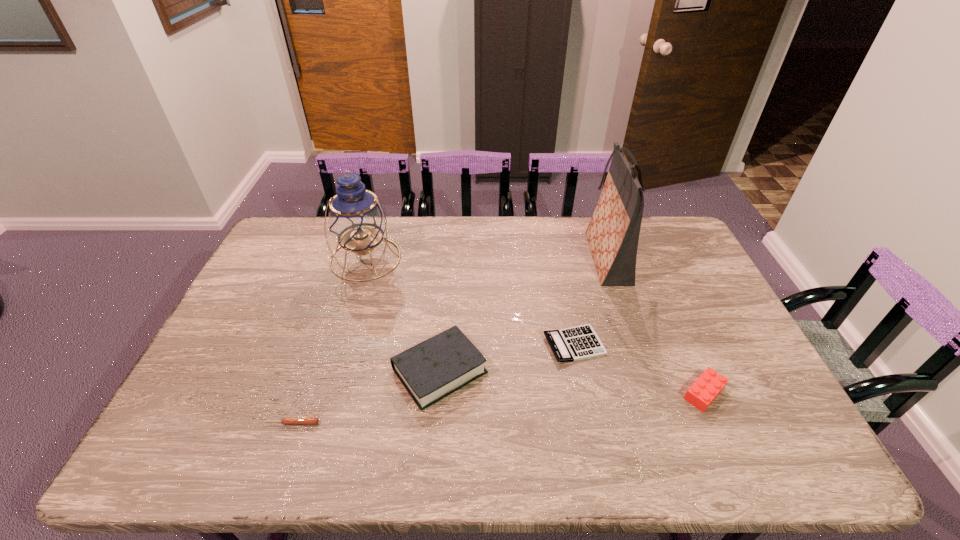
Where is `free region located on the front-facing side of the lantern`? This screenshot has height=540, width=960. free region located on the front-facing side of the lantern is located at coordinates (348, 316).

In order to click on vacant space situated 0.210m on the right of the Bible in this screenshot , I will do `click(566, 371)`.

Where is `free space located 0.080m on the left of the Lego`? free space located 0.080m on the left of the Lego is located at coordinates (650, 393).

You are a GUI agent. You are given a task and a screenshot of the screen. Output one action in this format:
    pyautogui.click(x=<x>, y=<y>)
    Task: Click on the vacant region located on the left of the calculator
    Image resolution: width=960 pixels, height=540 pixels.
    Given the screenshot: What is the action you would take?
    pyautogui.click(x=484, y=345)

This screenshot has width=960, height=540. Identify the location of vacant space situated on the right of the sausage. (381, 423).

This screenshot has height=540, width=960. What are the coordinates of `shopping bag that is positioned at the far edge` in the screenshot? It's located at (613, 233).

I want to click on lantern situated at the far edge, so click(357, 220).

Where is `object located at the right edge`? The width and height of the screenshot is (960, 540). object located at the right edge is located at coordinates (706, 388).

Where is `vacant space at the far edge of the desktop`? vacant space at the far edge of the desktop is located at coordinates (511, 227).

At what (x,y) coordinates should I click in order to perform the action: click on vacant space at the left edge of the desktop. Please return your answer as a coordinate pair (x, y). Looking at the image, I should click on (263, 310).